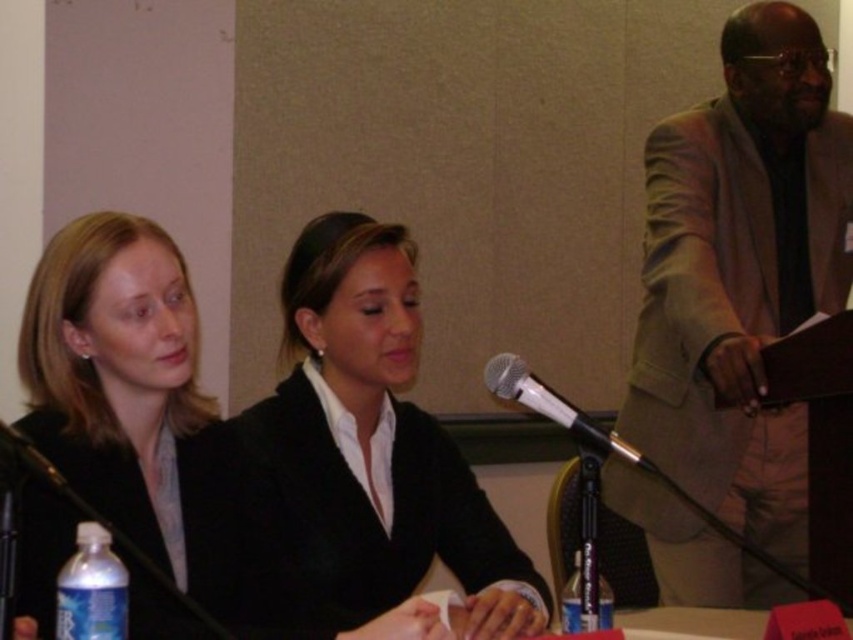
Question: Is silver metallic microphone at center behind black matte business suit at left?

Choices:
 (A) no
 (B) yes

Answer: (B)

Question: Among these points, which one is nearest to the camera?

Choices:
 (A) (44, 468)
 (B) (306, 460)
 (C) (598, 580)
 (D) (785, 436)

Answer: (A)

Question: Can you confirm if light brown suit at right is positioned below clear plastic bottle at lower left?

Choices:
 (A) yes
 (B) no

Answer: (B)

Question: Which point appears closest to the camera in this image?

Choices:
 (A) (523, 394)
 (B) (728, 392)
 (C) (6, 445)

Answer: (C)

Question: Which point is farther to the camera?

Choices:
 (A) clear plastic bottle at lower left
 (B) black matte business suit at left
 (C) clear plastic bottle at lower center
 (D) black matte blazer at center

Answer: (D)

Question: Is black matte blazer at center positioned behind silver metallic microphone at center?

Choices:
 (A) no
 (B) yes

Answer: (B)